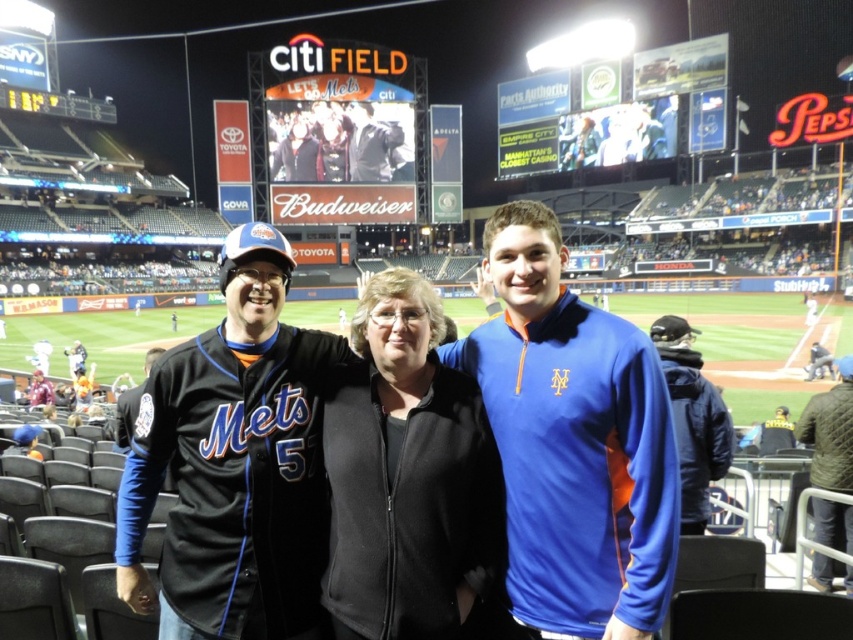
Question: Where is black jersey at center located in relation to blue jersey at center in the image?

Choices:
 (A) left
 (B) right

Answer: (A)

Question: Considering the relative positions of matte jersey at center and white digital display at upper center in the image provided, where is matte jersey at center located with respect to white digital display at upper center?

Choices:
 (A) above
 (B) below

Answer: (B)

Question: Which point is farther from the camera taking this photo?

Choices:
 (A) (125, 410)
 (B) (38, 403)

Answer: (B)

Question: In this image, where is black jersey at center located relative to matte black jersey at center?

Choices:
 (A) above
 (B) below

Answer: (A)

Question: Which point is farther to the camera?

Choices:
 (A) yellow plastic scoreboard at upper left
 (B) dark blue jersey at left
 (C) dark blue jacket at right
 (D) matte jersey at center

Answer: (A)

Question: Which object appears farthest from the camera in this image?

Choices:
 (A) blue fleece jacket at center
 (B) dark blue jacket at right
 (C) knitted wool sweater at lower right

Answer: (B)